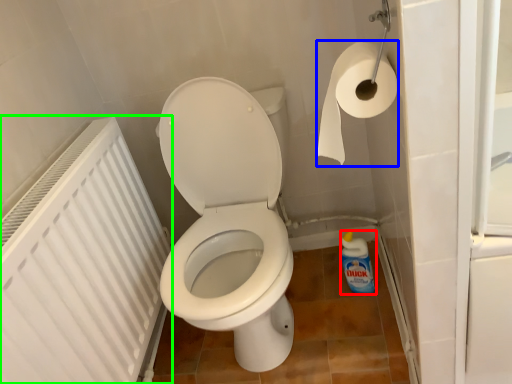
Question: Which object is the farthest from cleaning product (highlighted by a red box)? Choose among these: toilet paper (highlighted by a blue box) or radiator (highlighted by a green box).

Choices:
 (A) toilet paper
 (B) radiator

Answer: (B)